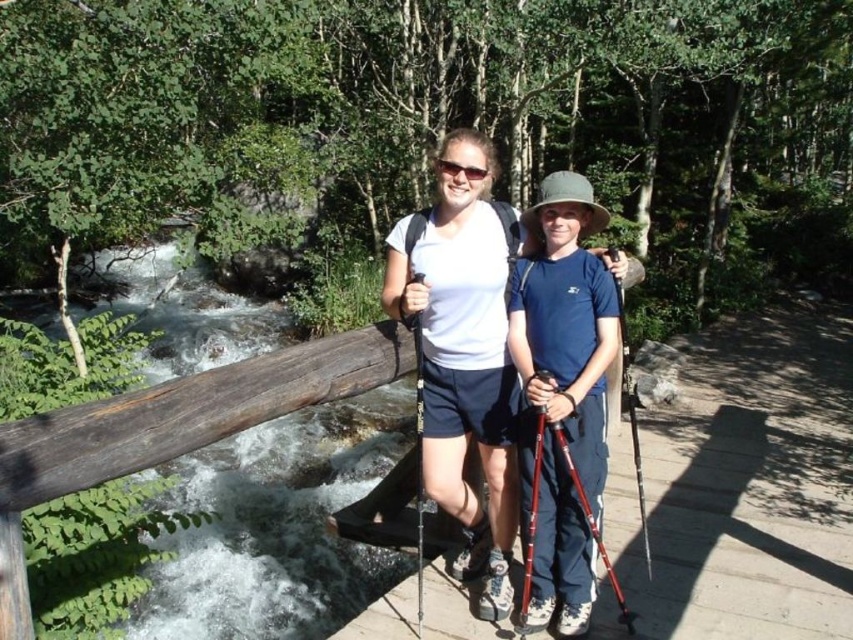
You are a photographer planning to take a portrait of the two hikers on the wooden bridge. You want to ensure that the white matte shirt at center and the matte blue shirt at center are both clearly visible in the frame. Based on their current positions, which shirt will appear larger in the photo?

The white matte shirt at center appears larger in the photo because it is positioned over the matte blue shirt at center, making it closer to the camera and thus appearing bigger.

You are a photographer trying to capture a closeup shot of the two hikers. Your camera has a maximum focus range of 30 centimeters. Can you take a photo of both the white matte shirt at center and the matte blue shirt at center without moving the camera?

The white matte shirt at center and the matte blue shirt at center are 29.13 centimeters apart from each other. Since this distance is within the camera maximum focus range of 30 centimeters, you can take a photo of both shirts without moving the camera.